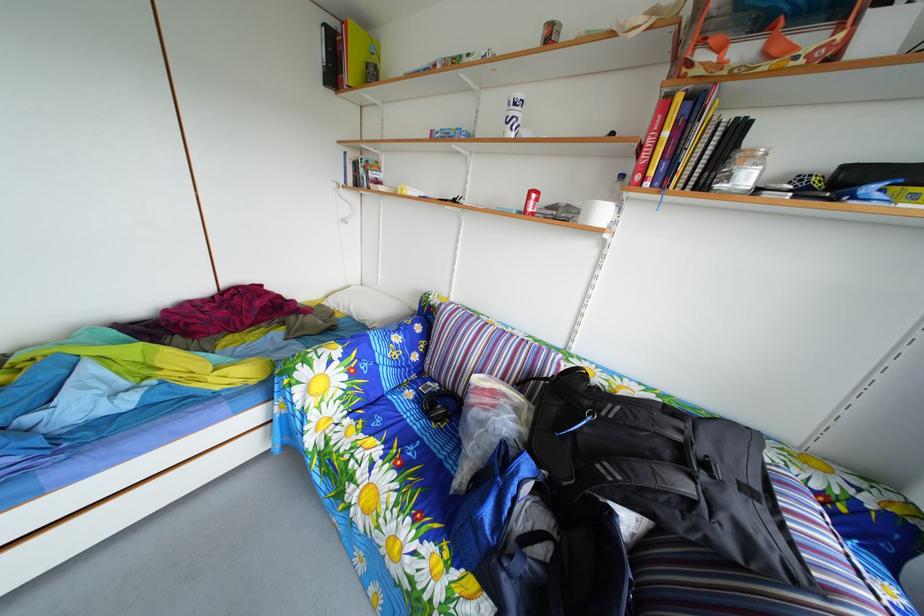
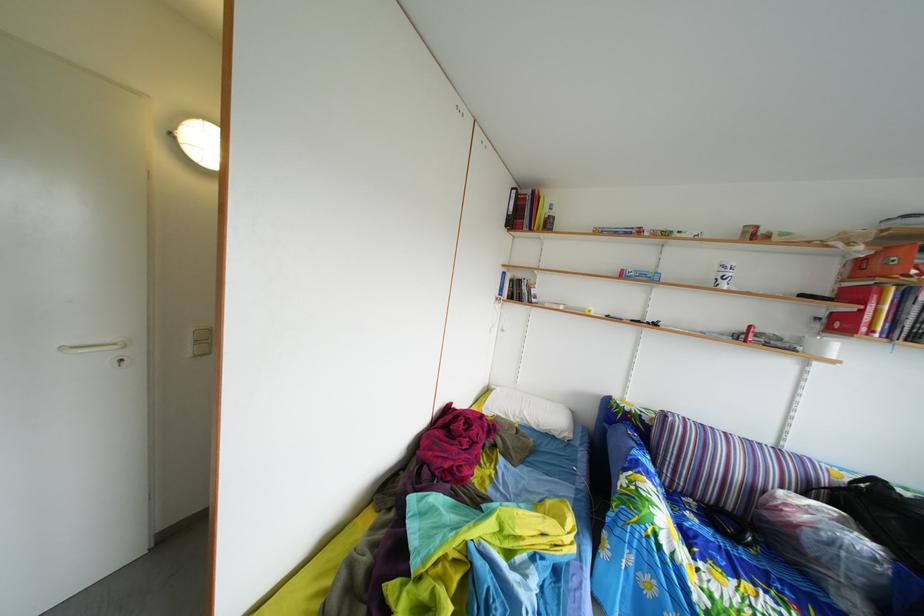
Question: The images are taken continuously from a first-person perspective. In which direction are you moving?

Choices:
 (A) Left
 (B) Right
 (C) Forward
 (D) Backward

Answer: (A)